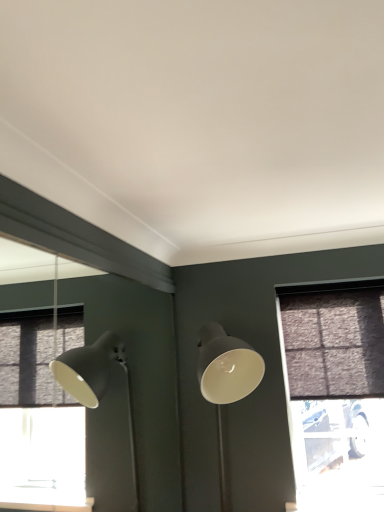
What is the approximate width of textured dark gray window at right?

textured dark gray window at right is 2.45 inches in width.

Describe the element at coordinates (335, 392) in the screenshot. I see `textured dark gray window at right` at that location.

What do you see at coordinates (334, 343) in the screenshot? Image resolution: width=384 pixels, height=512 pixels. I see `brown textured curtain at right` at bounding box center [334, 343].

Describe the element at coordinates (226, 379) in the screenshot. The height and width of the screenshot is (512, 384). I see `matte gray lamp at center` at that location.

Identify the location of textured dark gray window at right. (335, 392).

Is the position of brown textured curtain at right more distant than that of textured dark gray window at right?

That is False.

Does brown textured curtain at right touch textured dark gray window at right?

Yes, the surface of brown textured curtain at right is in contact with textured dark gray window at right.

Is brown textured curtain at right located outside textured dark gray window at right?

Yes, brown textured curtain at right is outside of textured dark gray window at right.

From the image's perspective, does brown textured curtain at right appear lower than textured dark gray window at right?

No.

From the picture: From the image's perspective, between textured dark gray window at right and brown textured curtain at right, which one is located above?

From the image's view, brown textured curtain at right is above.

From a real-world perspective, is textured dark gray window at right over brown textured curtain at right?

No, from a real-world perspective, textured dark gray window at right is not over brown textured curtain at right

Which point is more forward, (317, 300) or (362, 296)?

The point (362, 296) is closer to the camera.

From the image's perspective, which object appears higher, matte gray lamp at center or brown textured curtain at right?

brown textured curtain at right appears higher in the image.

How many degrees apart are the facing directions of matte gray lamp at center and brown textured curtain at right?

The angular difference between matte gray lamp at center and brown textured curtain at right is 0.576 degrees.

Which of these two, matte gray lamp at center or brown textured curtain at right, stands taller?

With more height is matte gray lamp at center.

This screenshot has height=512, width=384. In order to click on curtain located behind the matte gray lamp at center in this screenshot , I will do `click(334, 343)`.

Identify the location of window above the matte gray lamp at center (from a real-world perspective). (335, 392).

Which of these two, matte gray lamp at center or textured dark gray window at right, is smaller?

With smaller size is textured dark gray window at right.

Does matte gray lamp at center turn towards textured dark gray window at right?

No.

From the picture: From the image's perspective, which one is positioned lower, matte gray lamp at center or textured dark gray window at right?

From the image's view, matte gray lamp at center is below.

Where is `lamp that appears below the textured dark gray window at right (from the image's perspective)`? lamp that appears below the textured dark gray window at right (from the image's perspective) is located at coordinates (226, 379).

Considering the positions of objects textured dark gray window at right and matte gray lamp at center in the image provided, who is behind, textured dark gray window at right or matte gray lamp at center?

Positioned behind is textured dark gray window at right.

From the picture: Which of these two, textured dark gray window at right or matte gray lamp at center, stands shorter?

matte gray lamp at center.

From the image's perspective, who appears lower, textured dark gray window at right or matte gray lamp at center?

matte gray lamp at center is shown below in the image.

Is brown textured curtain at right further to the viewer compared to matte gray lamp at center?

That is True.

Considering the sizes of objects brown textured curtain at right and matte gray lamp at center in the image provided, who is taller, brown textured curtain at right or matte gray lamp at center?

With more height is matte gray lamp at center.

The image size is (384, 512). In the image, there is a matte gray lamp at center. In order to click on curtain above it (from the image's perspective) in this screenshot , I will do `click(334, 343)`.

Looking at this image, from the image's perspective, which one is positioned higher, brown textured curtain at right or matte gray lamp at center?

brown textured curtain at right.

At what (x,y) coordinates should I click in order to perform the action: click on curtain above the textured dark gray window at right (from the image's perspective). Please return your answer as a coordinate pair (x, y). Image resolution: width=384 pixels, height=512 pixels. Looking at the image, I should click on (334, 343).

Locate an element on the screen. curtain in front of the textured dark gray window at right is located at coordinates point(334,343).

Looking at the image, which one is located further to matte gray lamp at center, brown textured curtain at right or textured dark gray window at right?

The object further to matte gray lamp at center is textured dark gray window at right.

Looking at the image, which one is located further to textured dark gray window at right, matte gray lamp at center or brown textured curtain at right?

Based on the image, matte gray lamp at center appears to be further to textured dark gray window at right.

From the image, which object appears to be nearer to matte gray lamp at center, textured dark gray window at right or brown textured curtain at right?

brown textured curtain at right lies closer to matte gray lamp at center than the other object.

From the image, which object appears to be nearer to brown textured curtain at right, matte gray lamp at center or textured dark gray window at right?

textured dark gray window at right.

When comparing their distances from brown textured curtain at right, does textured dark gray window at right or matte gray lamp at center seem closer?

textured dark gray window at right is closer to brown textured curtain at right.

Looking at this image, considering their positions, is brown textured curtain at right positioned further to textured dark gray window at right than matte gray lamp at center?

The object further to textured dark gray window at right is matte gray lamp at center.

At what (x,y) coordinates should I click in order to perform the action: click on curtain between matte gray lamp at center and textured dark gray window at right along the z-axis. Please return your answer as a coordinate pair (x, y). Looking at the image, I should click on (334, 343).